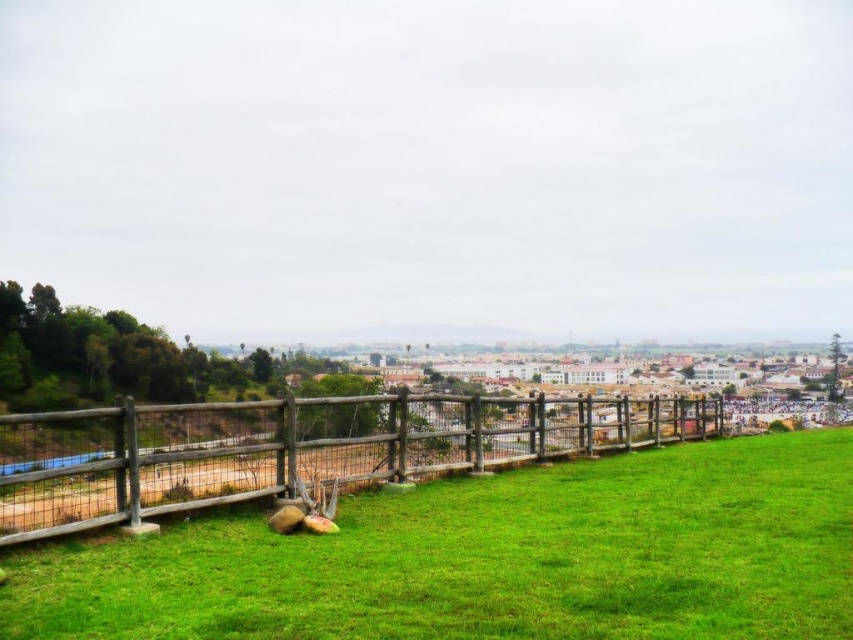
Question: Is green grassy at center to the left of brown wooden fence at lower left from the viewer's perspective?

Choices:
 (A) no
 (B) yes

Answer: (A)

Question: Observing the image, what is the correct spatial positioning of green grassy at center in reference to brown wooden fence at lower left?

Choices:
 (A) below
 (B) above

Answer: (B)

Question: Among these objects, which one is nearest to the camera?

Choices:
 (A) green grassy at center
 (B) brown wooden fence at lower left

Answer: (A)

Question: Which point is closer to the camera?

Choices:
 (A) brown wooden fence at lower left
 (B) green grassy at center

Answer: (B)

Question: Can you confirm if green grassy at center is positioned below brown wooden fence at lower left?

Choices:
 (A) no
 (B) yes

Answer: (A)

Question: Which point is farther to the camera?

Choices:
 (A) green grassy at center
 (B) brown wooden fence at lower left

Answer: (B)